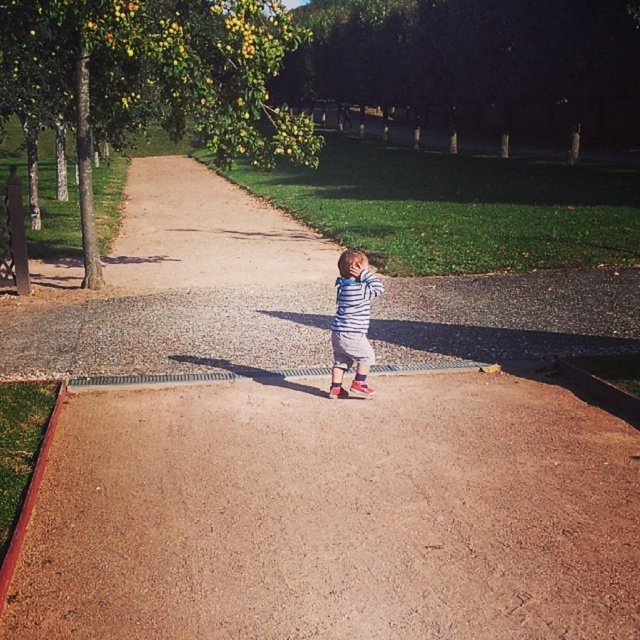
You are a delivery robot with a 1.5 meter reach. You need to place a package on the brown gravel dirt track at center while standing at the position of the striped cotton shirt at center. Can you do it?

The distance between the brown gravel dirt track at center and the striped cotton shirt at center is 1.73 meters. Since the robot has a 1.5 meter reach, it cannot reach the brown gravel dirt track at center from the striped cotton shirt at center.

Looking at this image, you are a parent trying to ensure your child stays on the brown gravel path at center while they hold the striped cotton shirt at center. Can you confirm if the path is wide enough for the child to walk comfortably without stepping off?

The brown gravel path at center is wider than the striped cotton shirt at center, so yes, the path is wide enough for the child to walk comfortably without stepping off.

You are a delivery drone flying above the park. You need to land at the exact location of the point marked at coordinates [205,234]. According to the image, where should you land?

The point marked at coordinates [205,234] is on the brown gravel path at center, so you should land on the brown gravel path at center.